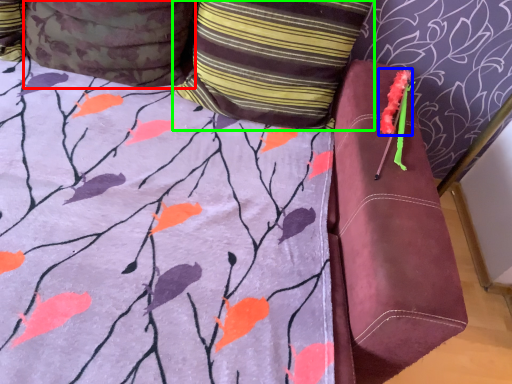
Question: Which object is positioned closest to pillow (highlighted by a red box)? Select from flower (highlighted by a blue box) and pillow (highlighted by a green box).

Choices:
 (A) flower
 (B) pillow

Answer: (B)